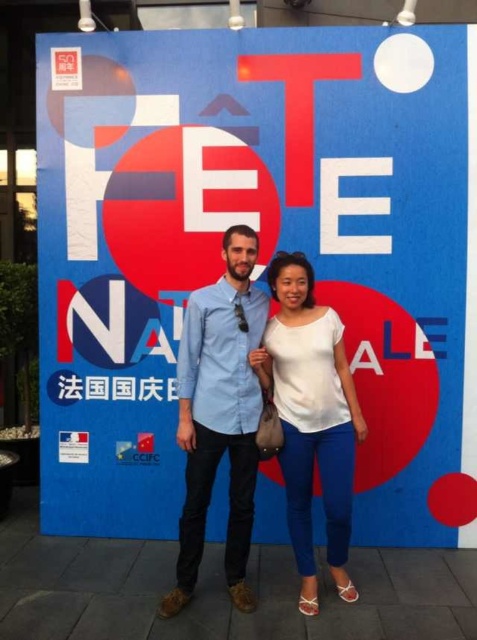
Question: Can you confirm if blue denim shirt at center is positioned to the right of white matte shirt at center?

Choices:
 (A) no
 (B) yes

Answer: (A)

Question: Which point is farther to the camera?

Choices:
 (A) (249, 480)
 (B) (301, 548)

Answer: (B)

Question: Does blue denim shirt at center have a larger size compared to white matte shirt at center?

Choices:
 (A) yes
 (B) no

Answer: (A)

Question: Does blue denim shirt at center appear on the right side of white matte shirt at center?

Choices:
 (A) yes
 (B) no

Answer: (B)